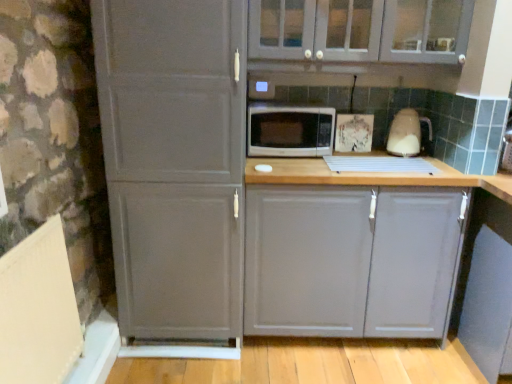
Question: Is matte gray cabinet at center, which is the 2th cabinetry from top to bottom, in front of or behind white glossy microwave at center in the image?

Choices:
 (A) behind
 (B) front

Answer: (B)

Question: From their relative heights in the image, would you say matte gray cabinet at center, the 1th cabinetry positioned from the bottom, is taller or shorter than white glossy microwave at center?

Choices:
 (A) tall
 (B) short

Answer: (A)

Question: Estimate the real-world distances between objects in this image. Which object is farther from the white glossy kettle at right?

Choices:
 (A) matte gray cabinet at center, the 1th cabinetry positioned from the bottom
 (B) matte gray cabinet at upper center, positioned as the second cabinetry in bottom-to-top order
 (C) matte gray cabinet at left
 (D) white glossy microwave at center

Answer: (C)

Question: Which object is the closest to the matte gray cabinet at upper center, positioned as the second cabinetry in bottom-to-top order?

Choices:
 (A) white glossy microwave at center
 (B) matte gray cabinet at center, the 1th cabinetry positioned from the bottom
 (C) matte gray cabinet at left
 (D) white glossy kettle at right

Answer: (A)